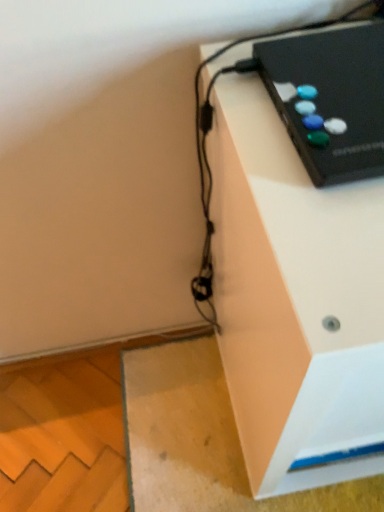
Question: Visually, is black plastic gamepad at upper right positioned to the left or to the right of black plastic remote control at upper right?

Choices:
 (A) right
 (B) left

Answer: (B)

Question: Is black plastic gamepad at upper right inside the boundaries of black plastic remote control at upper right, or outside?

Choices:
 (A) outside
 (B) inside

Answer: (A)

Question: Is black plastic gamepad at upper right wider or thinner than black plastic remote control at upper right?

Choices:
 (A) wide
 (B) thin

Answer: (B)

Question: Considering the positions of black plastic remote control at upper right and black plastic gamepad at upper right in the image, is black plastic remote control at upper right taller or shorter than black plastic gamepad at upper right?

Choices:
 (A) tall
 (B) short

Answer: (A)

Question: Is black plastic remote control at upper right to the left or to the right of black plastic gamepad at upper right in the image?

Choices:
 (A) left
 (B) right

Answer: (B)

Question: Which is correct: black plastic remote control at upper right is inside black plastic gamepad at upper right, or outside of it?

Choices:
 (A) outside
 (B) inside

Answer: (A)

Question: From the image's perspective, is black plastic remote control at upper right positioned above or below black plastic gamepad at upper right?

Choices:
 (A) below
 (B) above

Answer: (A)